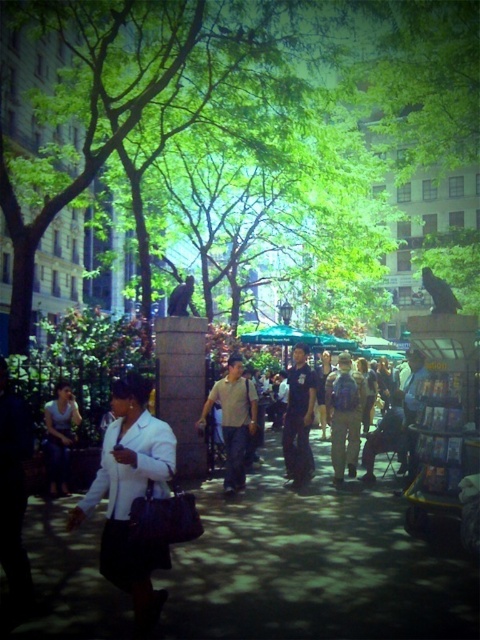
Question: Which of the following is the farthest from the observer?

Choices:
 (A) dark blue uniform at center
 (B) white matte blazer at center
 (C) matte black backpack at center

Answer: (A)

Question: Is dark brown backpack at center to the left of dark blue uniform at center from the viewer's perspective?

Choices:
 (A) yes
 (B) no

Answer: (B)

Question: Considering the real-world distances, which object is closest to the matte black backpack at center?

Choices:
 (A) white matte blazer at center
 (B) light brown fabric shirt at center
 (C) dark brown backpack at center

Answer: (C)

Question: Does dark blue backpack at center come behind white shirt at center?

Choices:
 (A) no
 (B) yes

Answer: (B)

Question: Which point appears closest to the camera in this image?

Choices:
 (A) (372, 474)
 (B) (294, 444)
 (C) (336, 435)

Answer: (B)

Question: Is dark blue uniform at center above white shirt at center?

Choices:
 (A) no
 (B) yes

Answer: (B)